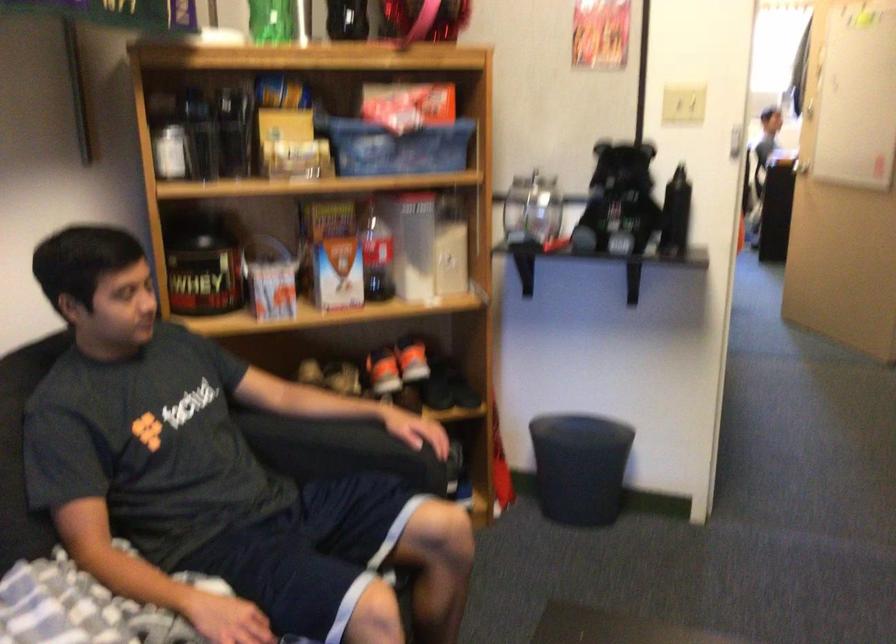
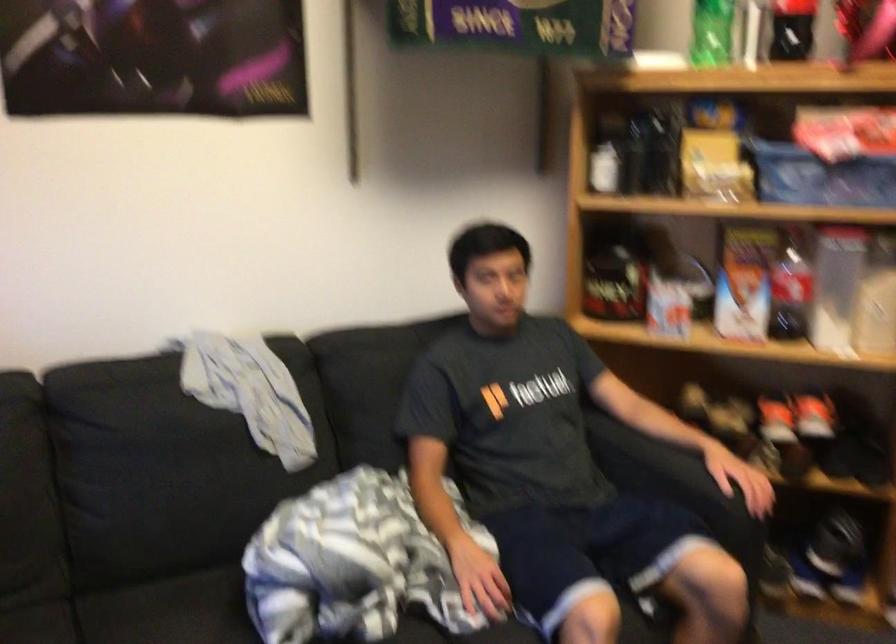
In the second image, find the point that corresponds to point (397, 146) in the first image.

(820, 176)